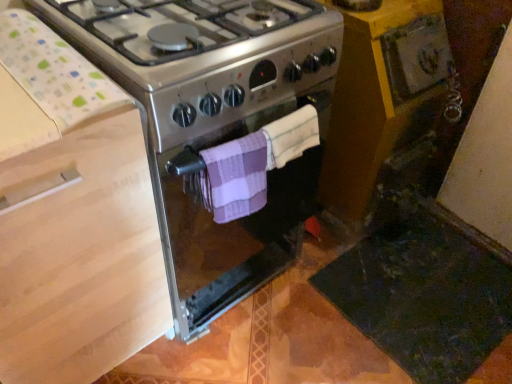
Question: Is wooden at left far away from purple checkered towel at center, arranged as the 2th towel/napkin when viewed from the left?

Choices:
 (A) no
 (B) yes

Answer: (A)

Question: Is wooden at left outside of purple checkered towel at center, arranged as the 2th towel/napkin when viewed from the left?

Choices:
 (A) yes
 (B) no

Answer: (A)

Question: Does wooden at left have a greater height compared to purple checkered towel at center, arranged as the 2th towel/napkin when viewed from the left?

Choices:
 (A) no
 (B) yes

Answer: (B)

Question: From a real-world perspective, is wooden at left positioned under purple checkered towel at center, arranged as the 2th towel/napkin when viewed from the left, based on gravity?

Choices:
 (A) no
 (B) yes

Answer: (B)

Question: Does wooden at left have a smaller size compared to purple checkered towel at center, which ranks as the first towel/napkin in right-to-left order?

Choices:
 (A) yes
 (B) no

Answer: (B)

Question: Is wooden at left oriented away from purple checkered towel at center, which ranks as the first towel/napkin in right-to-left order?

Choices:
 (A) yes
 (B) no

Answer: (B)

Question: From a real-world perspective, is yellow wood cabinet at lower right on top of purple checkered towel at center, arranged as the 2th towel/napkin when viewed from the left?

Choices:
 (A) yes
 (B) no

Answer: (B)

Question: Can you confirm if yellow wood cabinet at lower right is shorter than purple checkered towel at center, which ranks as the first towel/napkin in right-to-left order?

Choices:
 (A) no
 (B) yes

Answer: (A)

Question: Can you confirm if yellow wood cabinet at lower right is positioned to the right of purple checkered towel at center, which ranks as the first towel/napkin in right-to-left order?

Choices:
 (A) no
 (B) yes

Answer: (B)

Question: Would you say purple checkered towel at center, which ranks as the first towel/napkin in right-to-left order, is part of yellow wood cabinet at lower right's contents?

Choices:
 (A) no
 (B) yes

Answer: (A)

Question: Is yellow wood cabinet at lower right looking in the opposite direction of purple checkered towel at center, arranged as the 2th towel/napkin when viewed from the left?

Choices:
 (A) no
 (B) yes

Answer: (A)

Question: Can you confirm if yellow wood cabinet at lower right is taller than purple checkered towel at center, arranged as the 2th towel/napkin when viewed from the left?

Choices:
 (A) no
 (B) yes

Answer: (B)

Question: Does purple checkered towel at center, positioned as the 1th towel/napkin in left-to-right order, have a greater width compared to satin silver gas stove at center?

Choices:
 (A) yes
 (B) no

Answer: (B)